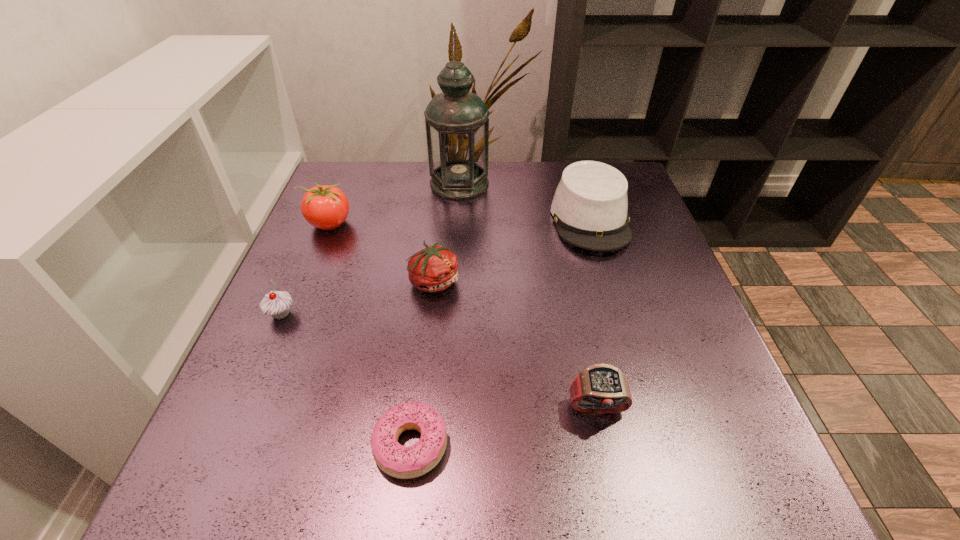
Find the location of a particular element. cupcake located at the left edge is located at coordinates (x=277, y=304).

Where is `object located at the right edge`? Image resolution: width=960 pixels, height=540 pixels. object located at the right edge is located at coordinates (590, 205).

You are a GUI agent. You are given a task and a screenshot of the screen. Output one action in this format:
    pyautogui.click(x=<x>, y=<y>)
    Task: Click on the object that is at the far right corner
    
    Given the screenshot: What is the action you would take?
    pyautogui.click(x=590, y=205)

What are the coordinates of `vacant space at the far edge` in the screenshot? It's located at (517, 171).

This screenshot has height=540, width=960. I want to click on free location at the left edge, so click(233, 400).

I want to click on free space at the right edge of the desktop, so click(674, 332).

I want to click on blank area at the far left corner, so click(335, 168).

Identify the location of vacant area at the near right corner of the desktop. Image resolution: width=960 pixels, height=540 pixels. (694, 471).

Locate an element on the screen. unoccupied area between the left tomato and the shorter tomato is located at coordinates (382, 252).

Locate an element on the screen. blank region between the hat and the nearer tomato is located at coordinates (513, 250).